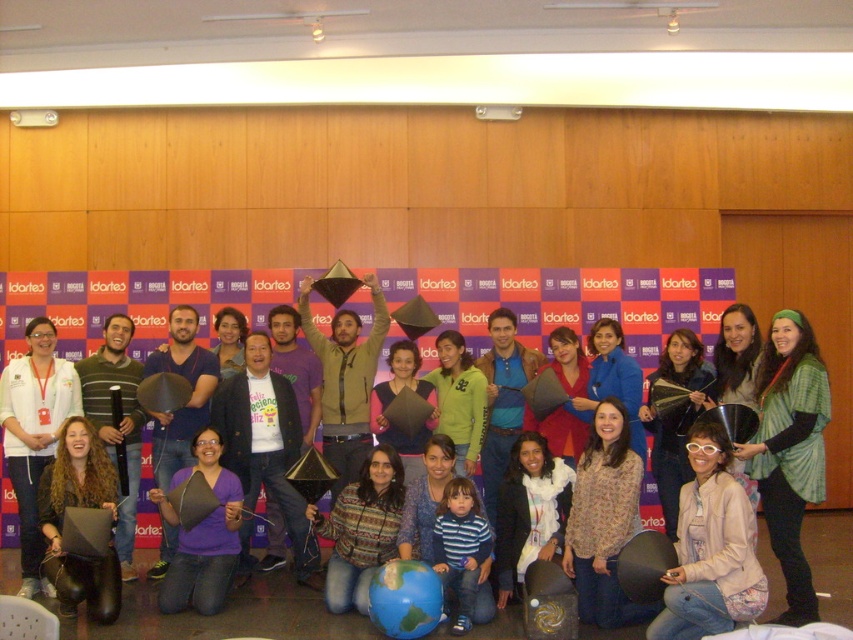
Does knitted sweater at center appear under purple matte triangle at center?

Indeed, knitted sweater at center is positioned under purple matte triangle at center.

In order to click on knitted sweater at center in this screenshot , I will do `click(361, 529)`.

Who is positioned more to the left, green knitted shawl at center or light beige jacket at lower right?

From the viewer's perspective, light beige jacket at lower right appears more on the left side.

Which is more to the right, green knitted shawl at center or light beige jacket at lower right?

green knitted shawl at center

Between point (780, 545) and point (722, 468), which one is positioned behind?

The point (780, 545) is more distant.

Find the location of a particular element. green knitted shawl at center is located at coordinates (788, 451).

Looking at this image, does floral print blouse at center come behind knitted sweater at center?

No, it is in front of knitted sweater at center.

Is floral print blouse at center thinner than knitted sweater at center?

Yes, floral print blouse at center is thinner than knitted sweater at center.

Who is more distant from viewer, [596,595] or [372,481]?

Positioned behind is point [372,481].

The height and width of the screenshot is (640, 853). Find the location of `floral print blouse at center`. floral print blouse at center is located at coordinates (602, 518).